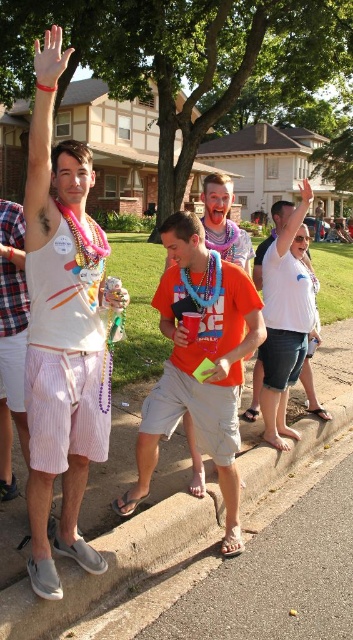
You are at the festive outdoor event and want to wave to someone at the upper left corner of the image. Which object at point (50, 60) can you use to wave?

The white matte hand at upper left located at point (50, 60) can be used to wave.

You are a photographer taking pictures of the festive gathering. You notice the matte white tank top at upper left and the multicolored beads at left. Which object is positioned higher in the image?

The multicolored beads at left are positioned higher than the matte white tank top at upper left, as the matte white tank top at upper left is below multicolored beads at left.

Consider the image. You are standing at the center of the image and want to find the matte white tank top at upper left. In which direction should you look to locate it?

The matte white tank top at upper left is located at point (63, 342), so you should look to the upper left direction to locate it.